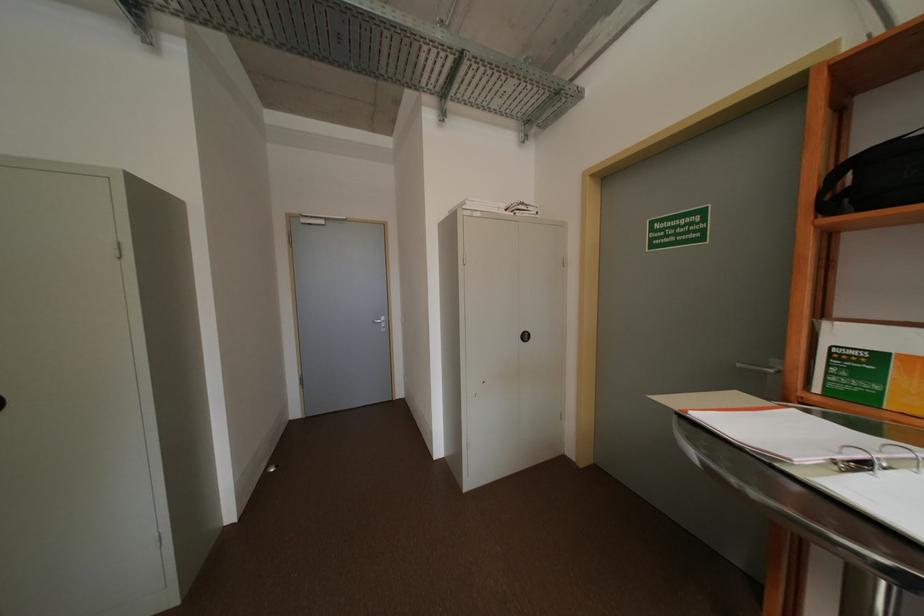
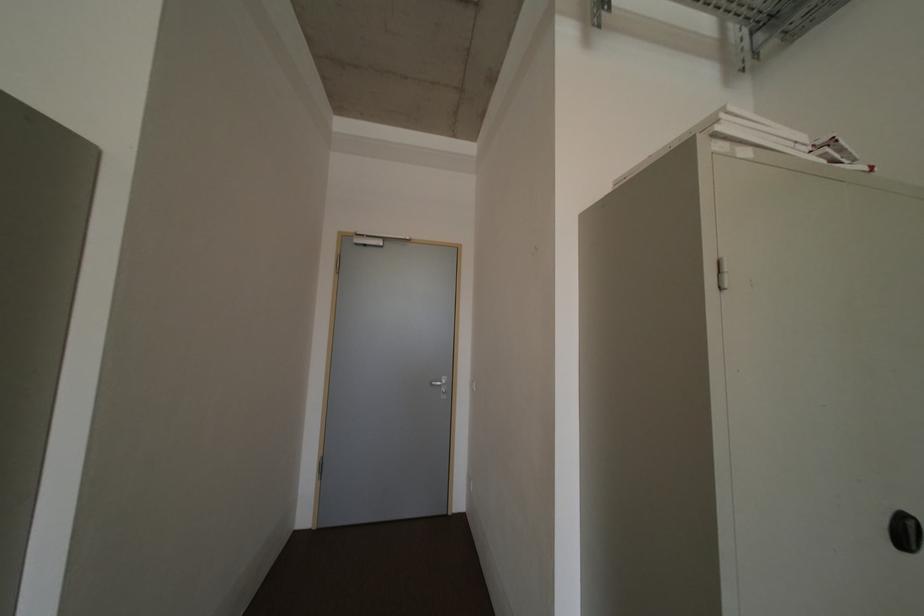
What movement of the cameraman would produce the second image?

The cameraman walked toward left, forward.